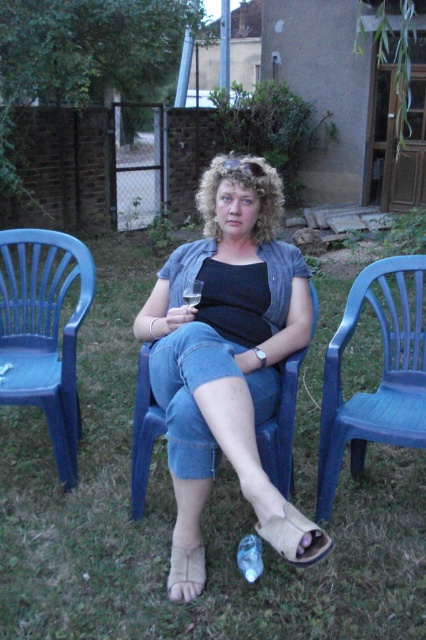
Question: Which is nearer to the leather sandal at lower center?

Choices:
 (A) denim shorts at center
 (B) beige fabric sandal at lower center
 (C) blue plastic chair at left
 (D) blue plastic chair at right

Answer: (A)

Question: Does denim shorts at center appear over leather sandal at lower center?

Choices:
 (A) yes
 (B) no

Answer: (A)

Question: Estimate the real-world distances between objects in this image. Which object is farther from the blue plastic chair at right?

Choices:
 (A) denim shorts at center
 (B) green grass at center
 (C) blue plastic chair at left
 (D) leather sandal at lower center

Answer: (C)

Question: Can you confirm if blue plastic chair at left is thinner than leather sandal at lower center?

Choices:
 (A) no
 (B) yes

Answer: (A)

Question: Is green grass at center bigger than denim shorts at center?

Choices:
 (A) yes
 (B) no

Answer: (A)

Question: Considering the real-world distances, which object is farthest from the beige fabric sandal at lower center?

Choices:
 (A) blue plastic chair at left
 (B) leather sandal at lower center

Answer: (A)